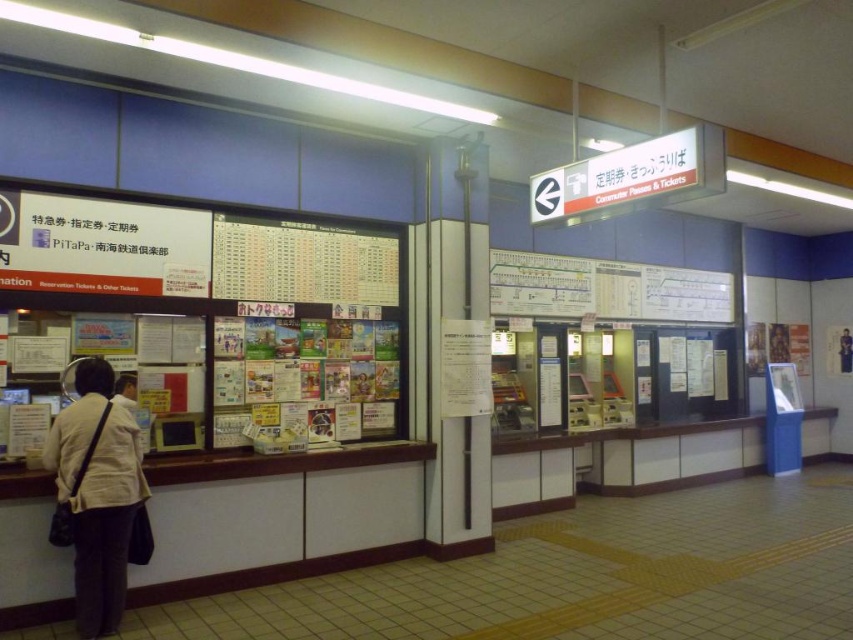
You are a traveler carrying a beige fabric jacket at lower left and a light beige jacket at left. You need to place both jackets on the ticket counter at the left side. However, the counter has a limited space. Which jacket should you place first to ensure both can fit?

The beige fabric jacket at lower left is wider than the light beige jacket at left. To ensure both can fit on the limited space of the ticket counter, place the wider beige fabric jacket at lower left first, then the narrower light beige jacket at left.

You are a traveler standing in front of the ticket counter at the train station. You notice two jackets hanging on a rack next to the counter. The jackets are labeled as the beige fabric jacket at lower left and the light beige jacket at left. Which jacket is positioned to the right when viewed from your perspective?

The beige fabric jacket at lower left is positioned to the right of the light beige jacket at left.